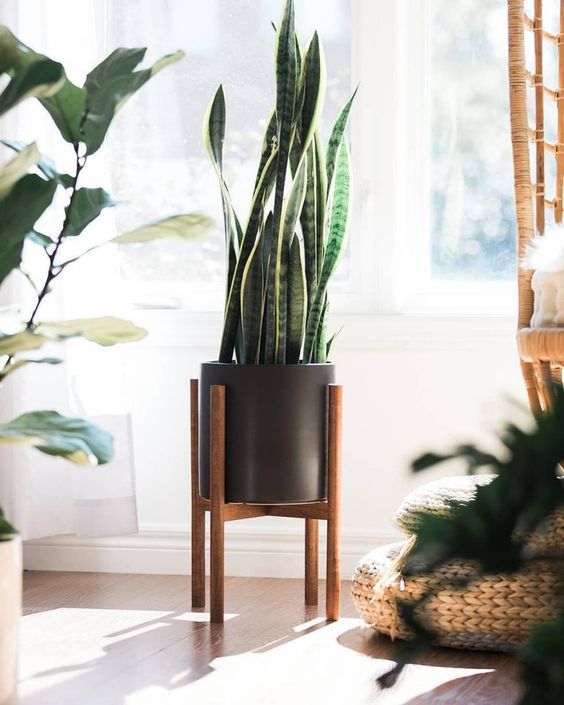
Find the location of a particular element. The height and width of the screenshot is (705, 564). 1 white flower pot is located at coordinates (12, 588).